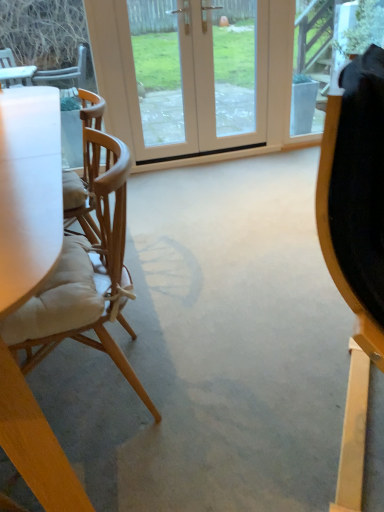
Identify the location of free space to the right of light beige fabric chair at left. (220, 385).